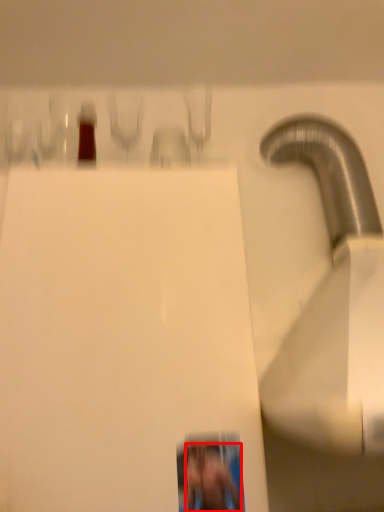
Question: From the image, what is the correct spatial relationship of person (annotated by the red box) in relation to wide?

Choices:
 (A) left
 (B) right

Answer: (B)